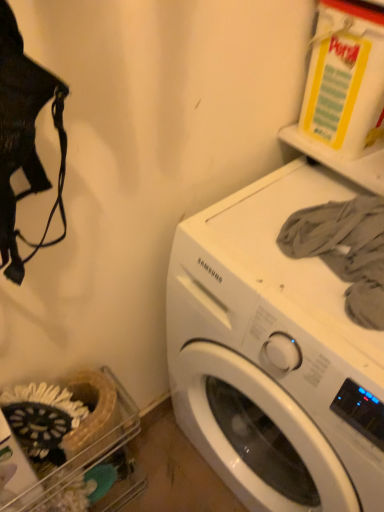
Question: From the image's perspective, relative to white glossy washing machine at center, is gray cotton shirt at upper right above or below?

Choices:
 (A) above
 (B) below

Answer: (A)

Question: Do you think gray cotton shirt at upper right is within white glossy washing machine at center, or outside of it?

Choices:
 (A) inside
 (B) outside

Answer: (B)

Question: From a real-world perspective, is gray cotton shirt at upper right positioned above or below white glossy washing machine at center?

Choices:
 (A) below
 (B) above

Answer: (B)

Question: Based on their positions, is white glossy washing machine at center located to the left or right of gray cotton shirt at upper right?

Choices:
 (A) right
 (B) left

Answer: (A)

Question: Is white glossy washing machine at center in front of or behind gray cotton shirt at upper right in the image?

Choices:
 (A) behind
 (B) front

Answer: (B)

Question: Does point (294, 499) appear closer or farther from the camera than point (379, 289)?

Choices:
 (A) farther
 (B) closer

Answer: (A)

Question: From a real-world perspective, is white glossy washing machine at center above or below gray cotton shirt at upper right?

Choices:
 (A) below
 (B) above

Answer: (A)